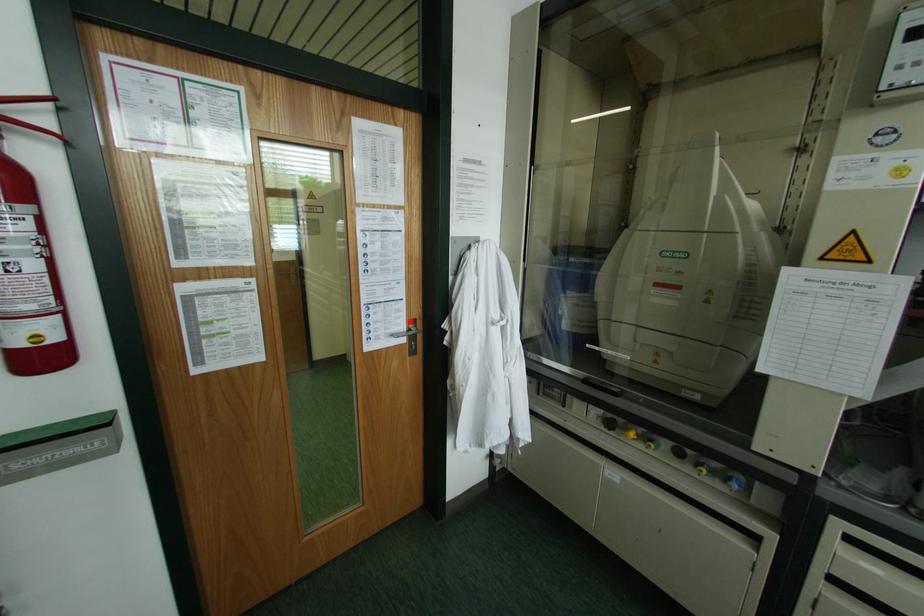
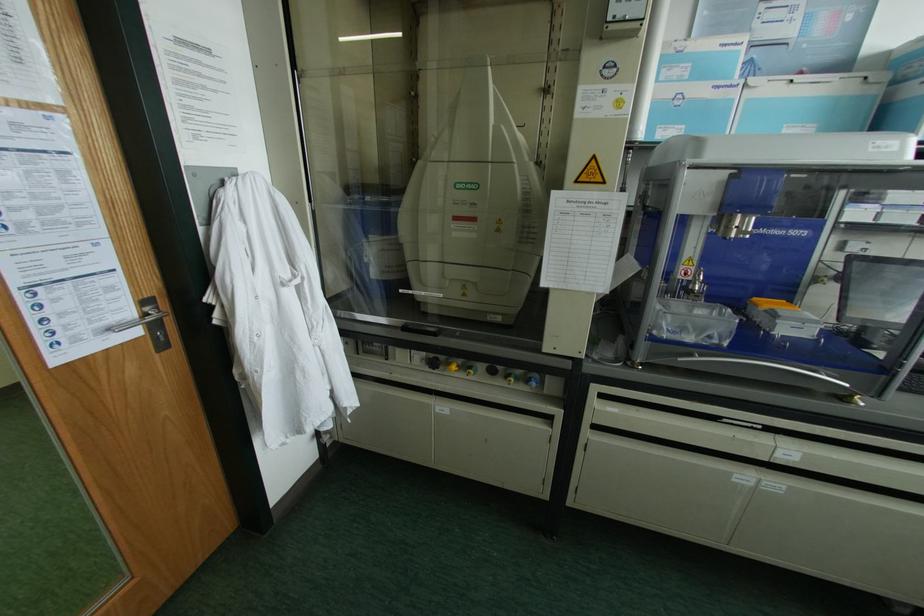
Locate, in the second image, the point that corresponds to the highlighted location in the first image.

(142, 302)